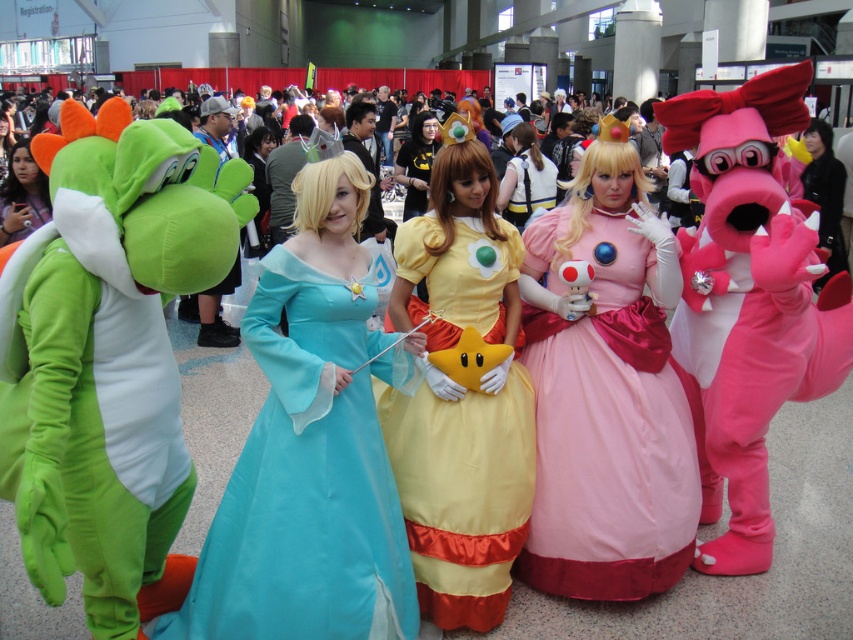
You are at a cosplay event and see two dresses in the center of the image. The pink satin dress at center and the yellow satin dress at center. Which one is positioned to the right?

The pink satin dress at center is to the right of the yellow satin dress at center, so the pink satin dress at center is positioned to the right.

Based on the photo, you are a photographer at the event and want to capture both the light brown fabric dress at center and the matte green costume at left in your photo. However, your camera can only focus on one subject at a time. Based on their positions, which subject should you focus on to ensure the other is still somewhat visible in the background?

You should focus on the light brown fabric dress at center because it is positioned over the matte green costume at left, meaning the matte green costume at left will appear in the background and remain somewhat visible.

Based on the photo, you are a photographer at the event and want to capture a photo of the pink satin dress at center without the matte blue dress at center blocking it. What should you do?

Move the camera position to the side so that the pink satin dress at center is no longer behind the matte blue dress at center, allowing it to be visible without obstruction.